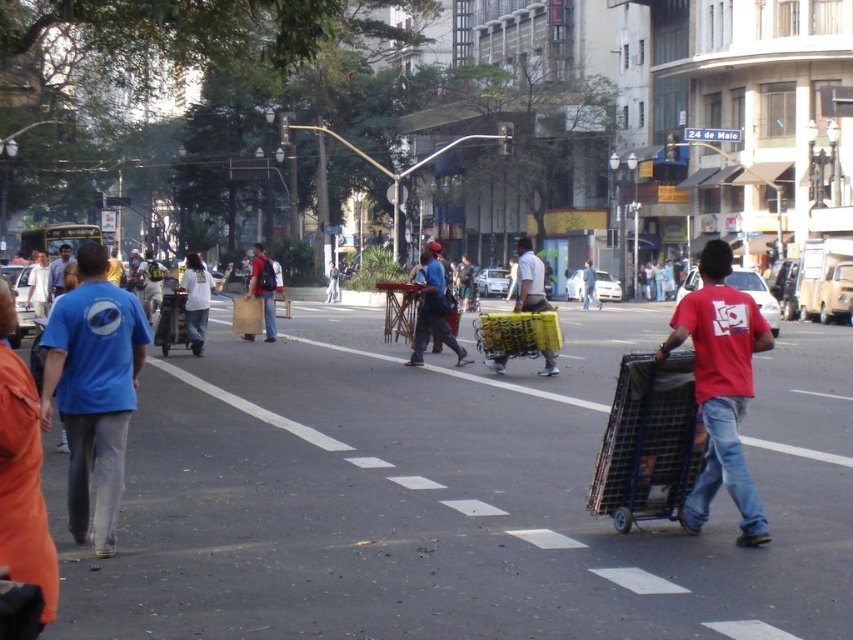
Question: Can you confirm if white matte shirt at center is positioned below metallic silver shopping cart at center?

Choices:
 (A) no
 (B) yes

Answer: (B)

Question: Is white matte shirt at center closer to camera compared to matte blue shirt at left?

Choices:
 (A) no
 (B) yes

Answer: (A)

Question: Which of the following is the closest to the observer?

Choices:
 (A) (532, 310)
 (B) (485, 314)
 (C) (256, 268)
 (D) (91, 273)

Answer: (D)

Question: Can you confirm if blue cotton shirt at left is bigger than metallic blue trolley at right?

Choices:
 (A) yes
 (B) no

Answer: (A)

Question: Which of the following is the closest to the observer?

Choices:
 (A) (265, 259)
 (B) (437, 244)
 (C) (592, 292)

Answer: (A)

Question: Which of these objects is positioned closest to the red fabric bag at center?

Choices:
 (A) matte yellow cart at center
 (B) matte brown paper bag at center
 (C) white matte shirt at center

Answer: (A)